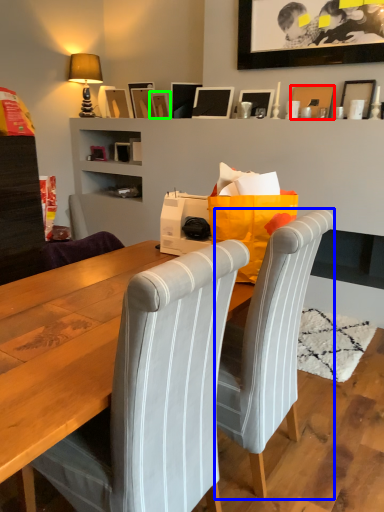
Question: Which object is positioned closest to picture frame (highlighted by a red box)? Select from chair (highlighted by a blue box) and picture frame (highlighted by a green box).

Choices:
 (A) chair
 (B) picture frame

Answer: (B)